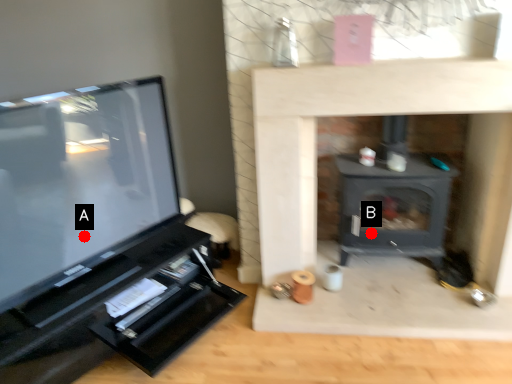
Question: Two points are circled on the image, labeled by A and B beside each circle. Which point appears farthest from the camera in this image?

Choices:
 (A) A is further
 (B) B is further

Answer: (A)